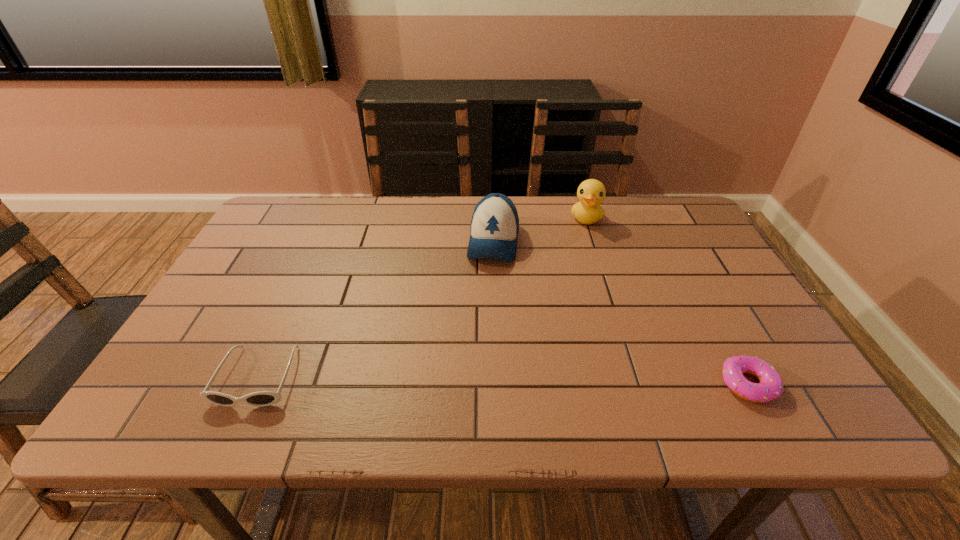
Identify the location of object at the near right corner. The image size is (960, 540). (771, 386).

The height and width of the screenshot is (540, 960). In the image, there is a desktop. Find the location of `vacant area at the far edge`. vacant area at the far edge is located at coordinates (540, 197).

You are a GUI agent. You are given a task and a screenshot of the screen. Output one action in this format:
    pyautogui.click(x=<x>, y=<y>)
    Task: Click on the free location at the near edge of the desktop
    
    Given the screenshot: What is the action you would take?
    pyautogui.click(x=368, y=362)

Find the location of `free location at the left edge`. free location at the left edge is located at coordinates (240, 341).

At what (x,y) coordinates should I click in order to perform the action: click on vacant space at the right edge. Please return your answer as a coordinate pair (x, y). Looking at the image, I should click on (707, 274).

Find the location of a particular element. The width and height of the screenshot is (960, 540). vacant space at the far left corner of the desktop is located at coordinates (274, 207).

Where is `blank space at the near left corner of the desktop`? The height and width of the screenshot is (540, 960). blank space at the near left corner of the desktop is located at coordinates (237, 368).

This screenshot has height=540, width=960. What are the coordinates of `empty space between the rightmost object and the leftmost object` in the screenshot? It's located at (503, 381).

In order to click on free area in between the duck and the rightmost object in this screenshot , I will do `click(667, 301)`.

Find the location of `free spot between the second shortest object and the duck`. free spot between the second shortest object and the duck is located at coordinates (422, 298).